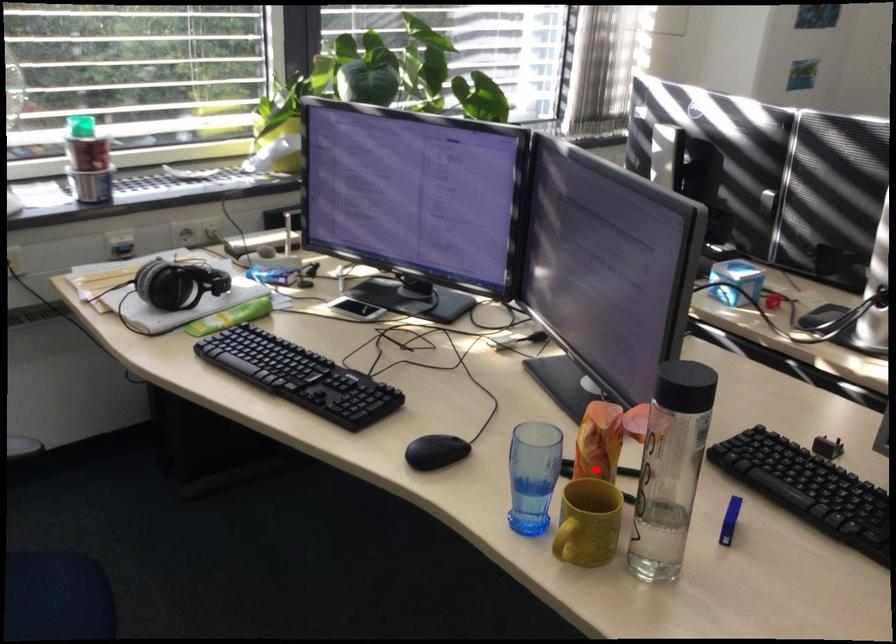
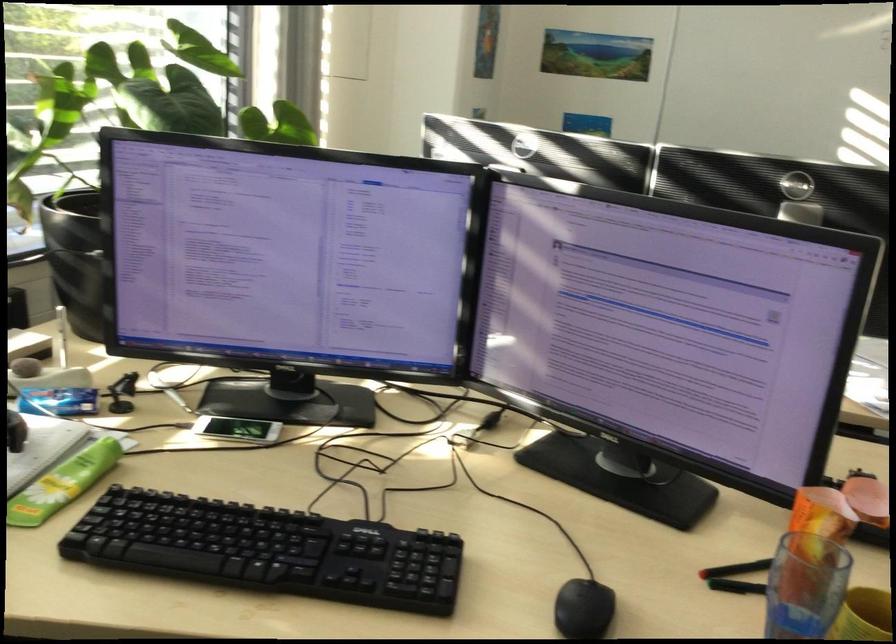
Question: I am providing you with two images of the same scene from different viewpoints. A red point is marked on the first image. Can you still see the location of the red point in image 2?

Choices:
 (A) Yes
 (B) No

Answer: (A)